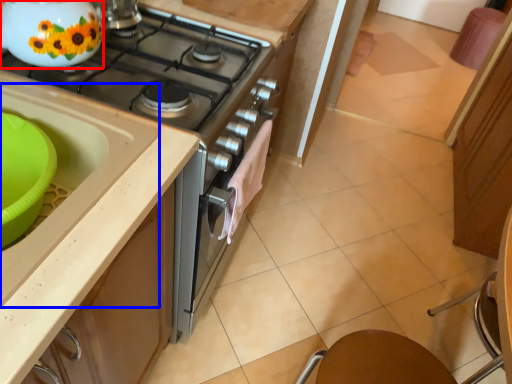
Question: Which of the following is the farthest to the observer, kitchen appliance (highlighted by a red box) or sink (highlighted by a blue box)?

Choices:
 (A) kitchen appliance
 (B) sink

Answer: (A)